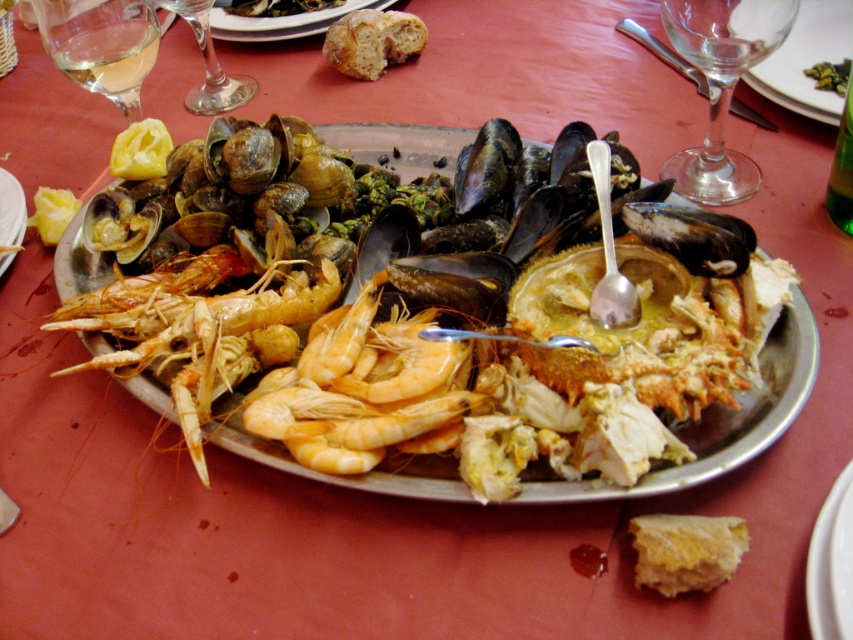
You are a waiter at a seafood restaurant and you see the clear glass wine glass at upper left and the transparent glass wine glass at upper left on the tray. Which one is taller?

The clear glass wine glass at upper left is much taller than the transparent glass wine glass at upper left.

You are a server at a restaurant and need to place a 10cm tall bottle of olive oil on the seafood platter. The bottle must be placed between the transparent glass wine glass at upper left and the metal spoon at upper center. Can you fit it there without overlapping either object?

The transparent glass wine glass at upper left is shorter than the metal spoon at upper center. Since the bottle is 10cm tall, but the question is about placement between them, the vertical height difference doesn

You are a server at a restaurant and need to place a 12.00 inch long bottle of wine on the table. The table has the seafood platter and a transparent glass wine glass at upper left. Where should you place the bottle so it doesn

The bottle should be placed between the seafood platter and the transparent glass wine glass at upper left since they are 33.00 inches apart, which is enough space to accommodate the 12.00 inch long bottle.